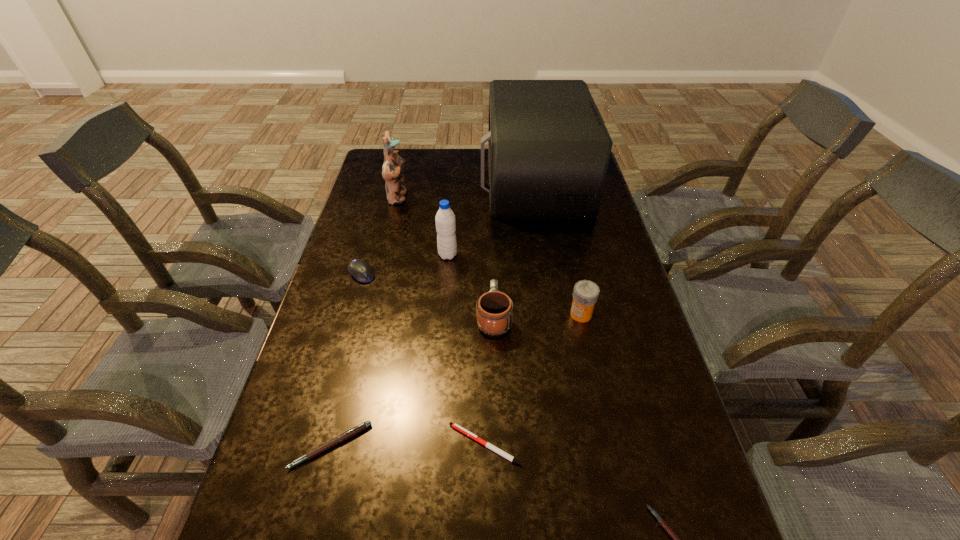
You are a GUI agent. You are given a task and a screenshot of the screen. Output one action in this format:
    pyautogui.click(x=<x>, y=<y>)
    Task: Click on the vacant area that lies between the orange medicine and the microwave oven
    The height and width of the screenshot is (540, 960).
    Given the screenshot: What is the action you would take?
    pyautogui.click(x=558, y=247)

Locate an element on the screen. The image size is (960, 540). unoccupied position between the second pen from left to right and the third farthest object is located at coordinates (467, 350).

Identify which object is located as the sixth nearest to the microwave oven. Please provide its 2D coordinates. Your answer should be formatted as a tuple, i.e. [(x, y)], where the tuple contains the x and y coordinates of a point satisfying the conditions above.

[(454, 425)]

Locate an element on the screen. the eighth closest object to the figurine is located at coordinates (676, 539).

Select which pen is the second closest to the mug. Please provide its 2D coordinates. Your answer should be formatted as a tuple, i.e. [(x, y)], where the tuple contains the x and y coordinates of a point satisfying the conditions above.

[(350, 433)]

Identify which pen is the second nearest to the tallest pen. Please provide its 2D coordinates. Your answer should be formatted as a tuple, i.e. [(x, y)], where the tuple contains the x and y coordinates of a point satisfying the conditions above.

[(676, 539)]

At what (x,y) coordinates should I click in order to perform the action: click on free space that satisfies the following two spatial constraints: 1. on the front-facing side of the microwave oven; 2. at the nib of the leftmost pen. Please return your answer as a coordinate pair (x, y). The width and height of the screenshot is (960, 540). Looking at the image, I should click on (578, 446).

This screenshot has height=540, width=960. I want to click on vacant region that satisfies the following two spatial constraints: 1. on the front-facing side of the pink figurine; 2. on the side of the mug with the handle, so click(x=370, y=318).